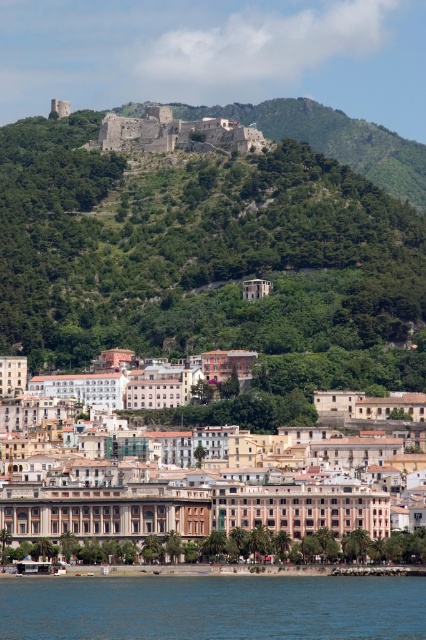
Locate an element on the screen. The height and width of the screenshot is (640, 426). green leafy hillside at upper center is located at coordinates (193, 248).

Where is `green leafy hillside at upper center`? The width and height of the screenshot is (426, 640). green leafy hillside at upper center is located at coordinates (193, 248).

Is beige stone buildings at center below blue liquid water at lower center?

Incorrect, beige stone buildings at center is not positioned below blue liquid water at lower center.

Who is positioned more to the right, beige stone buildings at center or blue liquid water at lower center?

beige stone buildings at center is more to the right.

The height and width of the screenshot is (640, 426). I want to click on beige stone buildings at center, so click(175, 509).

Does blue liquid water at lower center have a lesser height compared to rustic stone castle at upper center?

Yes.

Measure the distance between blue liquid water at lower center and camera.

119.28 meters

Image resolution: width=426 pixels, height=640 pixels. I want to click on blue liquid water at lower center, so click(213, 608).